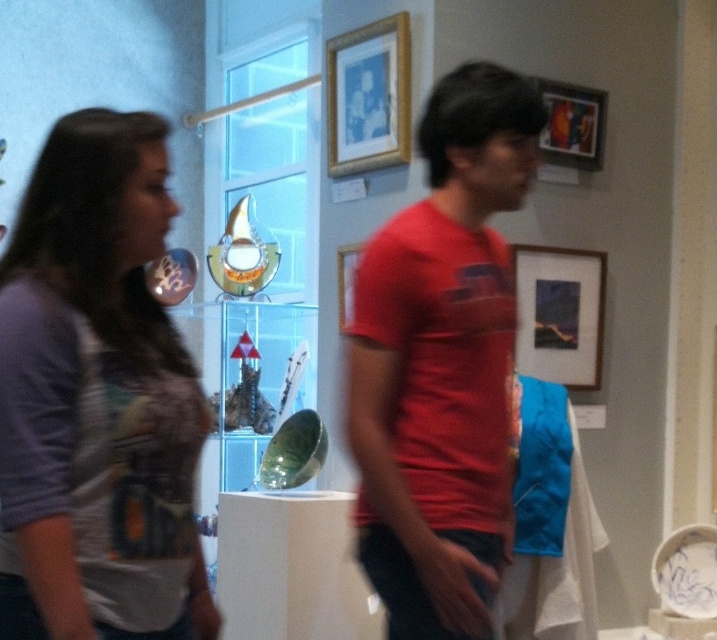
From the picture: Which of these two, gold-framed picture at upper center or wooden picture frame at upper right, stands taller?

With more height is gold-framed picture at upper center.

Does gold-framed picture at upper center have a lesser width compared to wooden picture frame at upper right?

Yes.

At what (x,y) coordinates should I click in order to perform the action: click on gold-framed picture at upper center. Please return your answer as a coordinate pair (x, y). The image size is (717, 640). Looking at the image, I should click on 369,97.

Can you confirm if matte red t-shirt at center is bigger than wooden picture frame at upper right?

Yes, matte red t-shirt at center is bigger than wooden picture frame at upper right.

Does point (460, 454) come in front of point (564, 145)?

Yes.

Where is `matte red t-shirt at center`? The image size is (717, 640). matte red t-shirt at center is located at coordinates (442, 364).

Can you confirm if gold-framed picture at upper center is smaller than matte wooden picture frame at upper right?

Incorrect, gold-framed picture at upper center is not smaller in size than matte wooden picture frame at upper right.

The image size is (717, 640). What do you see at coordinates (369, 97) in the screenshot? I see `gold-framed picture at upper center` at bounding box center [369, 97].

The image size is (717, 640). Identify the location of gold-framed picture at upper center. (369, 97).